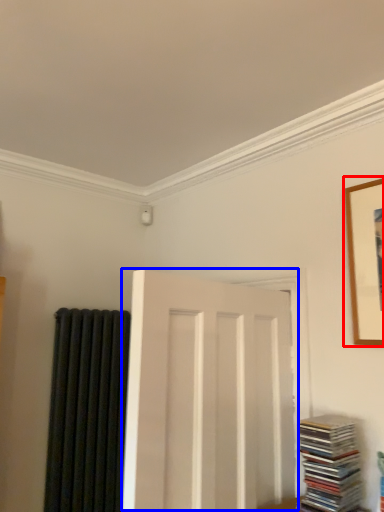
Question: Which of the following is the farthest to the observer, picture frame (highlighted by a red box) or door (highlighted by a blue box)?

Choices:
 (A) picture frame
 (B) door

Answer: (A)